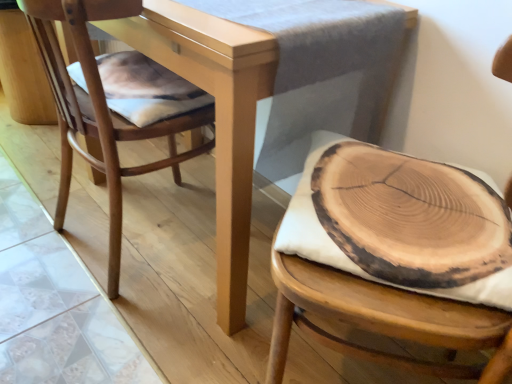
Question: Considering the relative sizes of natural wood slice at center and matte wood table at center in the image provided, is natural wood slice at center smaller than matte wood table at center?

Choices:
 (A) no
 (B) yes

Answer: (B)

Question: Is the position of natural wood slice at center more distant than that of matte wood table at center?

Choices:
 (A) no
 (B) yes

Answer: (A)

Question: From a real-world perspective, is natural wood slice at center located beneath matte wood table at center?

Choices:
 (A) yes
 (B) no

Answer: (B)

Question: Does natural wood slice at center lie in front of matte wood table at center?

Choices:
 (A) no
 (B) yes

Answer: (B)

Question: Does natural wood slice at center have a greater height compared to matte wood table at center?

Choices:
 (A) yes
 (B) no

Answer: (B)

Question: Is there a large distance between natural wood slice at center and matte wood table at center?

Choices:
 (A) no
 (B) yes

Answer: (A)

Question: From the image's perspective, is natural wood chair at left, acting as the second chair starting from the right, beneath natural wood slice at center?

Choices:
 (A) no
 (B) yes

Answer: (A)

Question: Is the depth of natural wood chair at left, which is the first chair in left-to-right order, greater than that of natural wood slice at center?

Choices:
 (A) yes
 (B) no

Answer: (A)

Question: Is natural wood chair at left, which is the first chair in left-to-right order, at the right side of natural wood slice at center?

Choices:
 (A) no
 (B) yes

Answer: (A)

Question: Considering the relative sizes of natural wood chair at left, acting as the second chair starting from the right, and natural wood slice at center in the image provided, is natural wood chair at left, acting as the second chair starting from the right, wider than natural wood slice at center?

Choices:
 (A) yes
 (B) no

Answer: (A)

Question: Is natural wood chair at left, which is the first chair in left-to-right order, oriented towards natural wood slice at center?

Choices:
 (A) yes
 (B) no

Answer: (B)

Question: From a real-world perspective, is natural wood chair at left, which is the first chair in left-to-right order, under natural wood slice at center?

Choices:
 (A) yes
 (B) no

Answer: (A)

Question: Is matte wood table at center further to the viewer compared to wooden cushion at right, which appears as the second chair when viewed from the left?

Choices:
 (A) no
 (B) yes

Answer: (B)